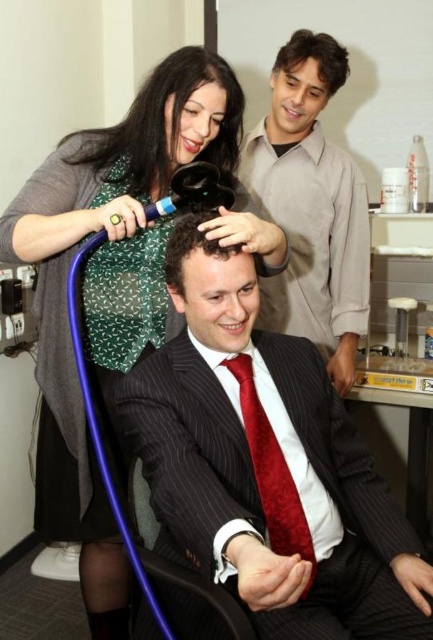
Between striped wool suit at center and metallic blue chair at lower center, which one appears on the left side from the viewer's perspective?

metallic blue chair at lower center is more to the left.

Is striped wool suit at center to the left of metallic blue chair at lower center from the viewer's perspective?

Incorrect, striped wool suit at center is not on the left side of metallic blue chair at lower center.

Looking at this image, measure the distance between point (222, 556) and camera.

Point (222, 556) and camera are 36.55 inches apart.

At what (x,y) coordinates should I click in order to perform the action: click on striped wool suit at center. Please return your answer as a coordinate pair (x, y). Looking at the image, I should click on (267, 465).

Does point (177, 582) come behind point (278, 58)?

That is False.

Is metallic blue chair at lower center shorter than shiny brown hair at upper right?

In fact, metallic blue chair at lower center may be taller than shiny brown hair at upper right.

Between point (132, 502) and point (296, 35), which one is positioned behind?

Point (296, 35)

Locate an element on the screen. metallic blue chair at lower center is located at coordinates (177, 561).

What do you see at coordinates (164, 125) in the screenshot?
I see `shiny black hairdryer at upper center` at bounding box center [164, 125].

Does shiny black hairdryer at upper center have a smaller size compared to curly brown hair at center?

Actually, shiny black hairdryer at upper center might be larger than curly brown hair at center.

Which is in front, point (122, 173) or point (190, 250)?

Point (190, 250)

Identify the location of shiny black hairdryer at upper center. The width and height of the screenshot is (433, 640). point(164,125).